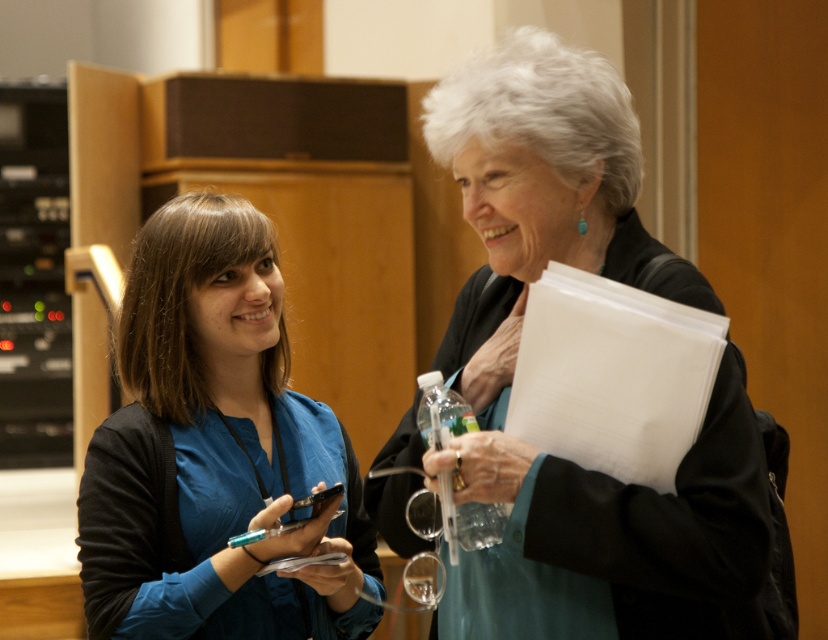
Question: Can you confirm if teal fabric jacket at center is positioned to the right of blue fabric shirt at center?

Choices:
 (A) yes
 (B) no

Answer: (A)

Question: Is teal fabric jacket at center further to camera compared to blue fabric shirt at center?

Choices:
 (A) no
 (B) yes

Answer: (A)

Question: Which of the following is the farthest from the observer?

Choices:
 (A) (291, 589)
 (B) (501, 536)

Answer: (A)

Question: Which point appears farthest from the camera in this image?

Choices:
 (A) (441, 403)
 (B) (372, 509)

Answer: (B)

Question: Among these points, which one is farthest from the camera?

Choices:
 (A) tap(585, 228)
 (B) tap(267, 236)

Answer: (B)

Question: Does teal fabric jacket at center appear on the left side of blue fabric shirt at center?

Choices:
 (A) no
 (B) yes

Answer: (A)